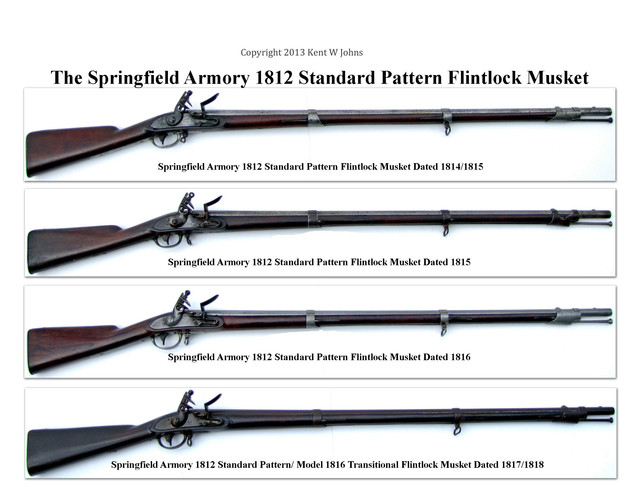
You are a GUI agent. You are given a task and a screenshot of the screen. Output one action in this format:
    pyautogui.click(x=<x>, y=<y>)
    Task: Click on the lock
    This screenshot has width=640, height=495.
    Given the screenshot: What is the action you would take?
    pyautogui.click(x=187, y=110), pyautogui.click(x=185, y=204), pyautogui.click(x=180, y=298), pyautogui.click(x=180, y=409)